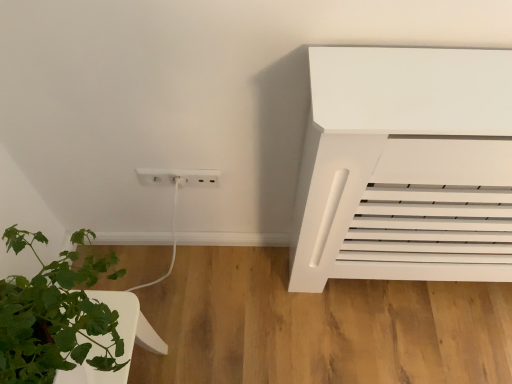
Measure the distance between green leafy plant at lower left and camera.

green leafy plant at lower left is 16.59 inches away from camera.

Locate an element on the screen. Image resolution: width=512 pixels, height=384 pixels. green leafy plant at lower left is located at coordinates (53, 317).

The image size is (512, 384). What do you see at coordinates (53, 317) in the screenshot?
I see `green leafy plant at lower left` at bounding box center [53, 317].

What is the approximate width of white plastic outlet at lower center?

white plastic outlet at lower center is 1.08 inches in width.

Image resolution: width=512 pixels, height=384 pixels. What do you see at coordinates (179, 177) in the screenshot?
I see `white plastic outlet at lower center` at bounding box center [179, 177].

Image resolution: width=512 pixels, height=384 pixels. In order to click on white plastic outlet at lower center in this screenshot , I will do `click(179, 177)`.

Image resolution: width=512 pixels, height=384 pixels. What are the coordinates of `green leafy plant at lower left` in the screenshot? It's located at 53,317.

In the scene shown: Would you say green leafy plant at lower left is to the left or to the right of white plastic outlet at lower center in the picture?

green leafy plant at lower left is positioned on white plastic outlet at lower center's left side.

Is the position of green leafy plant at lower left more distant than that of white plastic outlet at lower center?

No, green leafy plant at lower left is closer to the camera.

Is point (87, 285) behind point (175, 170)?

No, (87, 285) is closer to viewer.

From the image's perspective, which is above, green leafy plant at lower left or white plastic outlet at lower center?

white plastic outlet at lower center appears higher in the image.

From a real-world perspective, is green leafy plant at lower left positioned under white plastic outlet at lower center based on gravity?

Indeed, from a real-world perspective, green leafy plant at lower left is positioned beneath white plastic outlet at lower center.

Does green leafy plant at lower left have a lesser width compared to white plastic outlet at lower center?

Incorrect, the width of green leafy plant at lower left is not less than that of white plastic outlet at lower center.

Considering the sizes of green leafy plant at lower left and white plastic outlet at lower center in the image, is green leafy plant at lower left taller or shorter than white plastic outlet at lower center?

Considering their sizes, green leafy plant at lower left has more height than white plastic outlet at lower center.

Based on their sizes in the image, would you say green leafy plant at lower left is bigger or smaller than white plastic outlet at lower center?

Clearly, green leafy plant at lower left is larger in size than white plastic outlet at lower center.

Do you think green leafy plant at lower left is within white plastic outlet at lower center, or outside of it?

green leafy plant at lower left is located beyond the bounds of white plastic outlet at lower center.

From the picture: Is green leafy plant at lower left touching white plastic outlet at lower center?

green leafy plant at lower left and white plastic outlet at lower center are clearly separated.

Could you tell me if green leafy plant at lower left is turned towards white plastic outlet at lower center?

No, green leafy plant at lower left is not aimed at white plastic outlet at lower center.

Can you tell me how much green leafy plant at lower left and white plastic outlet at lower center differ in facing direction?

The angular difference between green leafy plant at lower left and white plastic outlet at lower center is 88.7 degrees.

At what (x,y) coordinates should I click in order to perform the action: click on houseplant below the white plastic outlet at lower center (from a real-world perspective). Please return your answer as a coordinate pair (x, y). The image size is (512, 384). Looking at the image, I should click on [53, 317].

Considering the positions of objects white plastic outlet at lower center and green leafy plant at lower left in the image provided, who is more to the left, white plastic outlet at lower center or green leafy plant at lower left?

green leafy plant at lower left is more to the left.

Who is more distant, white plastic outlet at lower center or green leafy plant at lower left?

white plastic outlet at lower center is behind.

Does point (201, 185) come closer to viewer compared to point (96, 269)?

No, (201, 185) is behind (96, 269).

From the image's perspective, would you say white plastic outlet at lower center is positioned over green leafy plant at lower left?

Correct, white plastic outlet at lower center appears higher than green leafy plant at lower left in the image.

From a real-world perspective, which object stands above the other?

white plastic outlet at lower center, from a real-world perspective.

In the scene shown: Can you confirm if white plastic outlet at lower center is wider than green leafy plant at lower left?

Incorrect, the width of white plastic outlet at lower center does not surpass that of green leafy plant at lower left.

Is white plastic outlet at lower center taller than green leafy plant at lower left?

In fact, white plastic outlet at lower center may be shorter than green leafy plant at lower left.

Can you confirm if white plastic outlet at lower center is bigger than green leafy plant at lower left?

Incorrect, white plastic outlet at lower center is not larger than green leafy plant at lower left.

Is white plastic outlet at lower center not within green leafy plant at lower left?

Yes, white plastic outlet at lower center is not within green leafy plant at lower left.

Is white plastic outlet at lower center not close to green leafy plant at lower left?

They are positioned close to each other.

Is white plastic outlet at lower center positioned with its back to green leafy plant at lower left?

No, white plastic outlet at lower center is not facing the opposite direction of green leafy plant at lower left.

Locate an element on the screen. The width and height of the screenshot is (512, 384). electric outlet that appears above the green leafy plant at lower left (from the image's perspective) is located at coordinates (179, 177).

Locate an element on the screen. houseplant below the white plastic outlet at lower center (from a real-world perspective) is located at coordinates (53, 317).

Where is `electric outlet that is above the green leafy plant at lower left (from the image's perspective)`? The width and height of the screenshot is (512, 384). electric outlet that is above the green leafy plant at lower left (from the image's perspective) is located at coordinates (179, 177).